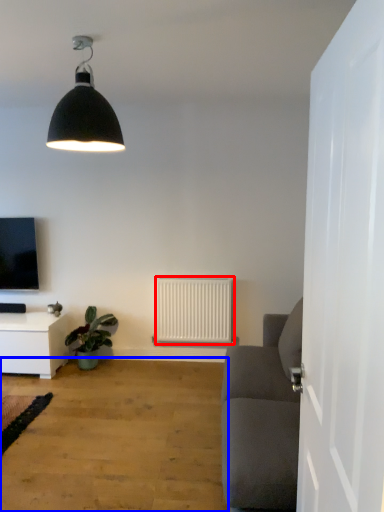
Question: Which object is further to the camera taking this photo, radiator (highlighted by a red box) or plain (highlighted by a blue box)?

Choices:
 (A) radiator
 (B) plain

Answer: (A)